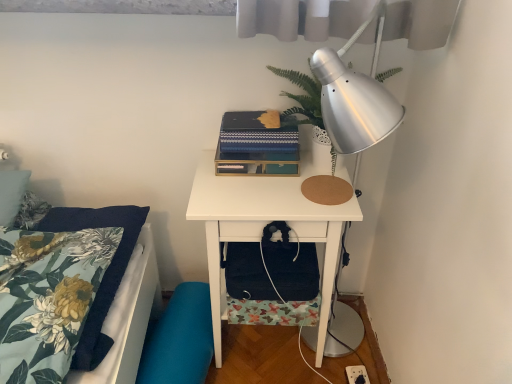
Question: From a real-world perspective, is blue textured book at center positioned above or below teal fabric swivel chair at lower left?

Choices:
 (A) above
 (B) below

Answer: (A)

Question: Is blue textured book at center to the left or to the right of teal fabric swivel chair at lower left in the image?

Choices:
 (A) left
 (B) right

Answer: (B)

Question: Estimate the real-world distances between objects in this image. Which object is farther from the white matte nightstand at center?

Choices:
 (A) blue textured book at center
 (B) black fabric bag at lower center
 (C) green leafy plant at upper right
 (D) floral fabric pillow at left
 (E) teal fabric swivel chair at lower left

Answer: (C)

Question: Which object is the farthest from the black fabric bag at lower center?

Choices:
 (A) blue textured book at center
 (B) floral fabric pillow at left
 (C) white matte nightstand at center
 (D) teal fabric swivel chair at lower left
 (E) green leafy plant at upper right

Answer: (E)